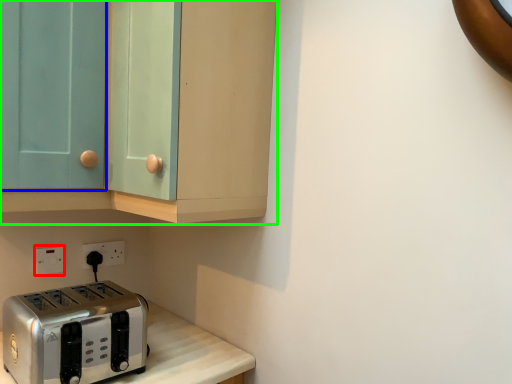
Question: Considering the real-world distances, which object is farthest from electric outlet (highlighted by a red box)? glass door (highlighted by a blue box) or cabinetry (highlighted by a green box)?

Choices:
 (A) glass door
 (B) cabinetry

Answer: (B)